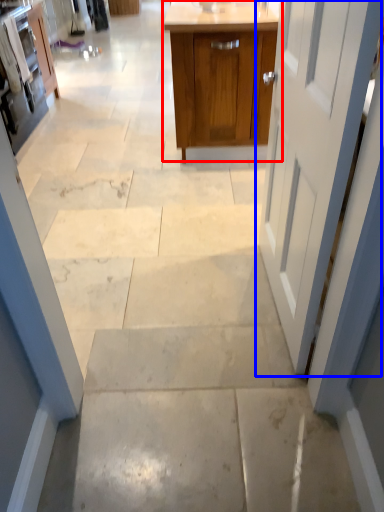
Question: Which of the following is the closest to the observer, cabinetry (highlighted by a red box) or door (highlighted by a blue box)?

Choices:
 (A) cabinetry
 (B) door

Answer: (B)